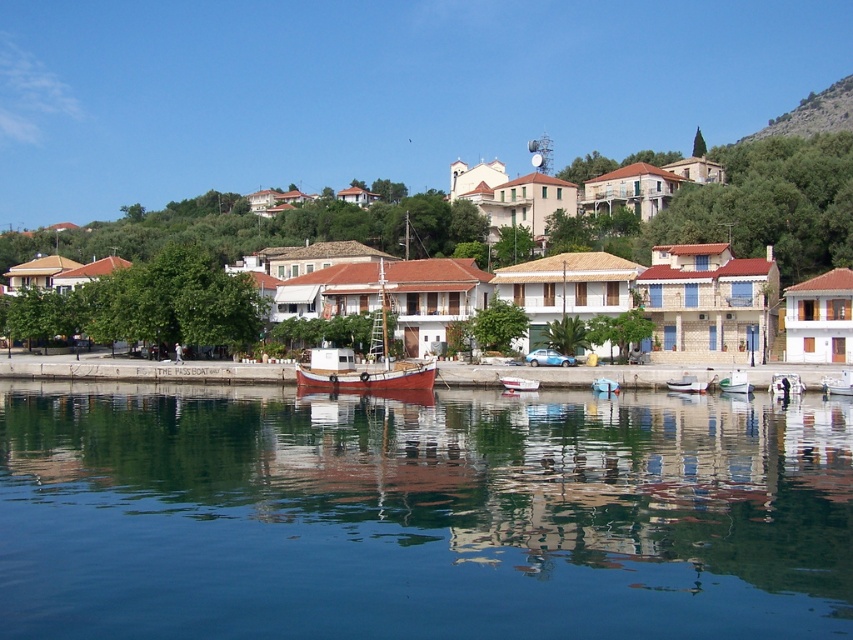
Question: Which point is closer to the camera taking this photo?

Choices:
 (A) (523, 387)
 (B) (821, 99)
 (C) (598, 381)

Answer: (C)

Question: Among these points, which one is farthest from the camera?

Choices:
 (A) (532, 388)
 (B) (843, 99)

Answer: (B)

Question: Does transparent water at center have a greater width compared to green grassy hillside at upper right?

Choices:
 (A) yes
 (B) no

Answer: (A)

Question: Does white glossy boat at lower right appear on the right side of white plastic boat at center?

Choices:
 (A) yes
 (B) no

Answer: (A)

Question: Where is white glossy boat at lower right located in relation to wooden boat at center in the image?

Choices:
 (A) left
 (B) right

Answer: (B)

Question: Which point is farther to the camera?

Choices:
 (A) (277, 596)
 (B) (376, 376)
 (C) (838, 387)
 (D) (599, 378)

Answer: (B)